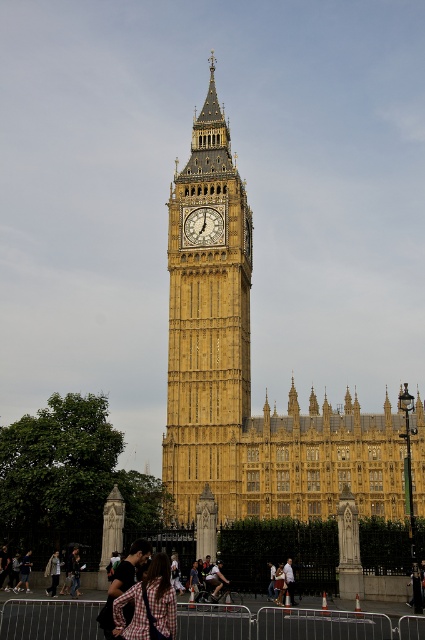
Question: Which point appears closest to the camera in this image?

Choices:
 (A) (56, 580)
 (B) (180, 410)
 (C) (195, 237)
 (D) (289, 573)

Answer: (D)

Question: Does plaid fabric backpack at lower center have a smaller size compared to light brown leather jacket at lower left?

Choices:
 (A) yes
 (B) no

Answer: (A)

Question: Is yellow stone clock tower at center thinner than light brown leather jacket at lower left?

Choices:
 (A) yes
 (B) no

Answer: (B)

Question: Which point is closer to the camera?

Choices:
 (A) (51, 586)
 (B) (127, 596)
 (C) (210, 68)

Answer: (B)

Question: Is light brown leather jacket at lower left above light brown leather jacket at center?

Choices:
 (A) no
 (B) yes

Answer: (A)

Question: Among these points, which one is nearest to the camera?

Choices:
 (A) (183, 224)
 (B) (197, 173)
 (C) (53, 563)
 (D) (288, 577)

Answer: (D)